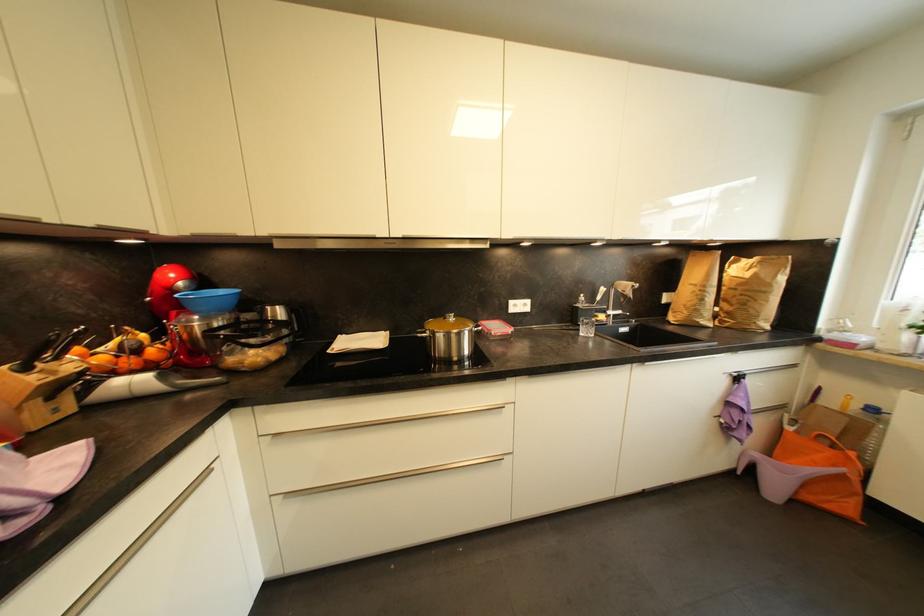
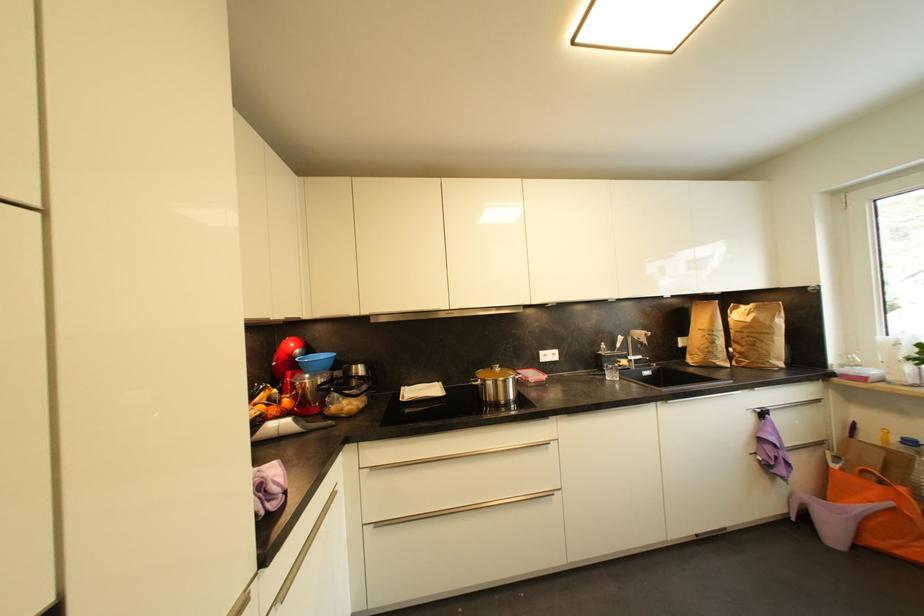
Where in the second image is the point corresponding to point (293, 496) from the first image?

(382, 527)